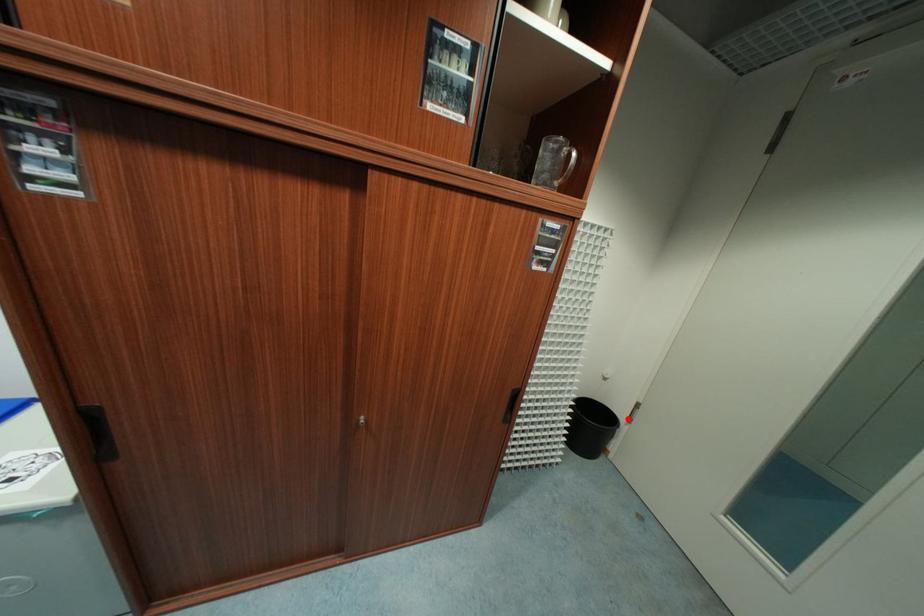
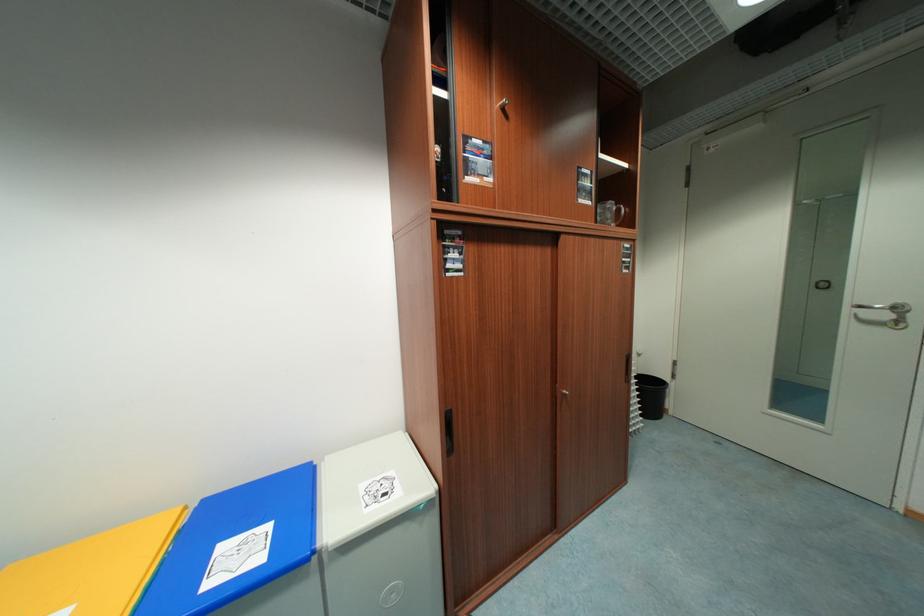
Question: I am providing you with two images of the same scene from different viewpoints. In image1, a red point is highlighted. Considering the same 3D point in image2, which of the following is correct?

Choices:
 (A) It is closer
 (B) It is farther

Answer: (B)